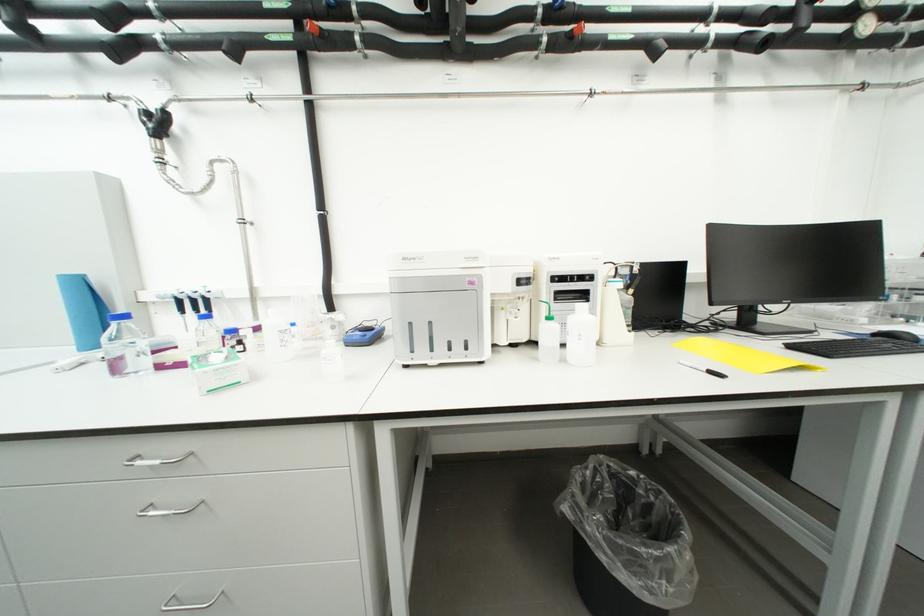
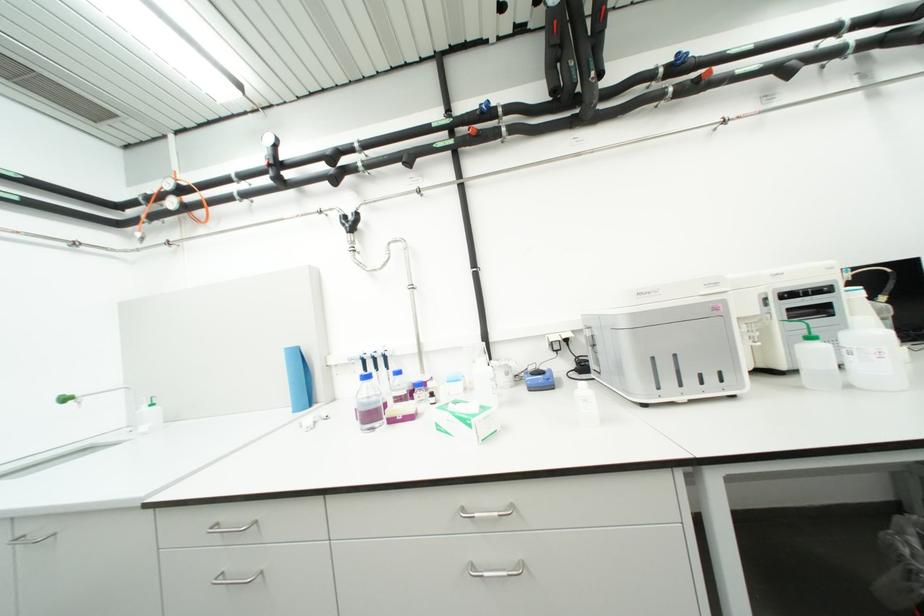
Find the pixel in the second image that matches point 168,369 in the first image.

(399, 422)